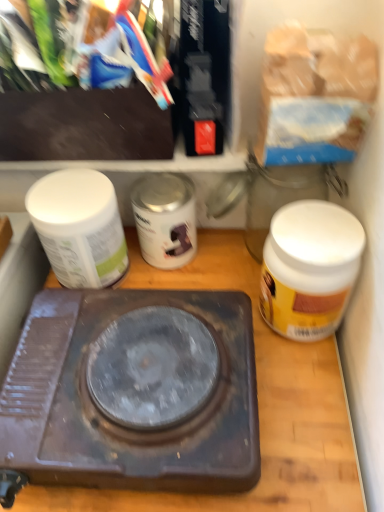
Question: Is point (82, 243) positioned closer to the camera than point (314, 285)?

Choices:
 (A) closer
 (B) farther

Answer: (B)

Question: Is white matte jar at left, the first bottle when ordered from left to right, inside or outside of white matte jar at right, the third bottle when ordered from left to right?

Choices:
 (A) outside
 (B) inside

Answer: (A)

Question: Considering the real-world distances, which object is closest to the white matte jar at left, the first bottle when ordered from left to right?

Choices:
 (A) white matte jar at right, which is counted as the 1th bottle, starting from the right
 (B) rusty metal stove at center
 (C) silver metallic can at center, the 2th bottle from the right
 (D) brown matte/wooden counter top at center

Answer: (C)

Question: Estimate the real-world distances between objects in this image. Which object is closer to the white matte jar at left, the first bottle when ordered from left to right?

Choices:
 (A) white matte jar at right, which is counted as the 1th bottle, starting from the right
 (B) brown matte/wooden counter top at center
 (C) silver metallic can at center, the 2th bottle from the right
 (D) rusty metal stove at center

Answer: (C)